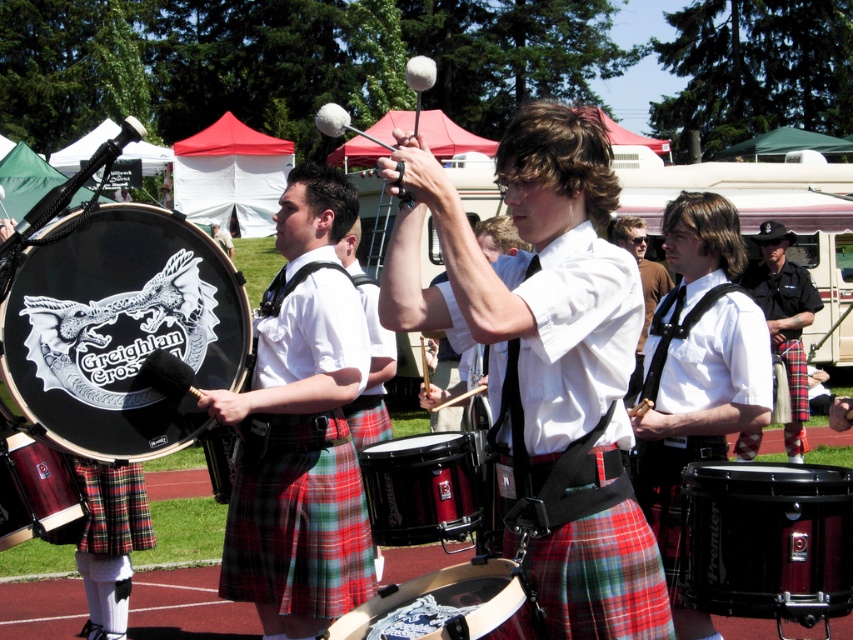
Which of these two, black polished drum at center or black leather hat at upper right, stands shorter?

Standing shorter between the two is black polished drum at center.

Does black polished drum at center have a greater width compared to black leather hat at upper right?

Incorrect, black polished drum at center's width does not surpass black leather hat at upper right's.

Where is `black polished drum at center`? Image resolution: width=853 pixels, height=640 pixels. black polished drum at center is located at coordinates (766, 540).

Find the location of a particular element. black polished drum at center is located at coordinates (766, 540).

Is black polished drum at center above brown leather jacket at center?

Incorrect, black polished drum at center is not positioned above brown leather jacket at center.

Who is higher up, black polished drum at center or brown leather jacket at center?

Positioned higher is brown leather jacket at center.

Locate an element on the screen. black polished drum at center is located at coordinates (766, 540).

Locate an element on the screen. black polished drum at center is located at coordinates (766, 540).

Does matte black drum at center lie in front of black leather hat at upper right?

Yes, matte black drum at center is in front of black leather hat at upper right.

Which of these two, matte black drum at center or black leather hat at upper right, stands taller?

Standing taller between the two is black leather hat at upper right.

Between point (672, 408) and point (802, 448), which one is positioned behind?

Point (802, 448)

Image resolution: width=853 pixels, height=640 pixels. In order to click on matte black drum at center in this screenshot , I will do `click(697, 360)`.